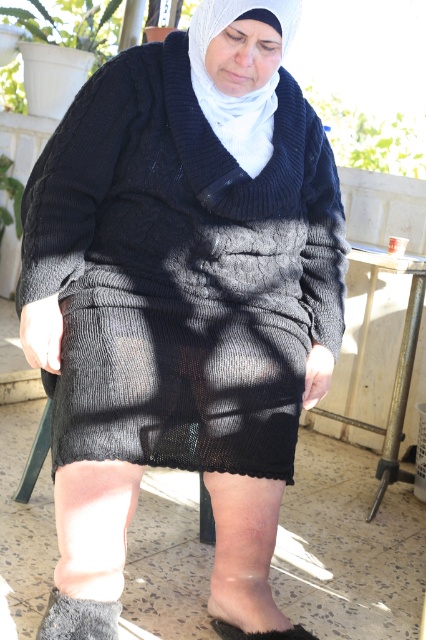
You are a photographer trying to capture the white knitted headscarf at center in the image. Given that the camera is focused at point (242, 93), which object in the scene is exactly at that point?

The point (242, 93) marks the white knitted headscarf at center.

You are a fashion designer observing the seated individual. You need to determine which item is bigger between the white knitted headscarf at center and the gray fuzzy sock at lower left. Which one is larger?

The white knitted headscarf at center is larger in size than the gray fuzzy sock at lower left.

Consider the image. You are a photographer trying to capture a closeup of the gray fuzzy sock at lower left and the gray fabric foot at lower center. Since you want to focus on both objects clearly, which one should you adjust your camera focus to prioritize based on their sizes?

The gray fuzzy sock at lower left has a smaller width than the gray fabric foot at lower center. To focus on both clearly, prioritize the smaller object as it requires more precise focus due to its smaller size.